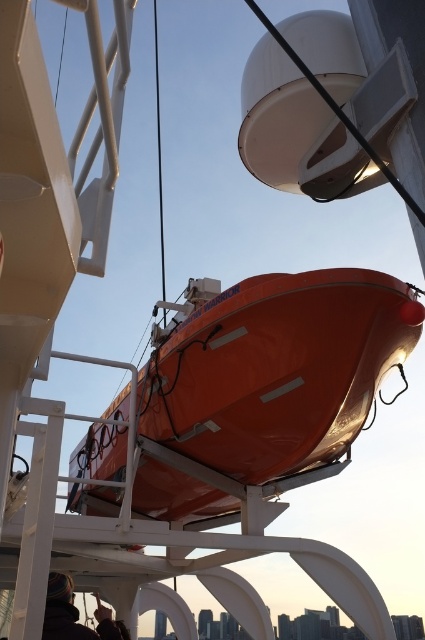
Question: Can you confirm if orange glossy boat at center is smaller than dark brown leather jacket at lower left?

Choices:
 (A) yes
 (B) no

Answer: (B)

Question: Which of the following is the farthest from the observer?

Choices:
 (A) (129, 637)
 (B) (397, 340)

Answer: (A)

Question: Does orange glossy boat at center have a smaller size compared to dark brown leather jacket at lower left?

Choices:
 (A) yes
 (B) no

Answer: (B)

Question: Can you confirm if orange glossy boat at center is smaller than dark brown leather jacket at lower left?

Choices:
 (A) yes
 (B) no

Answer: (B)